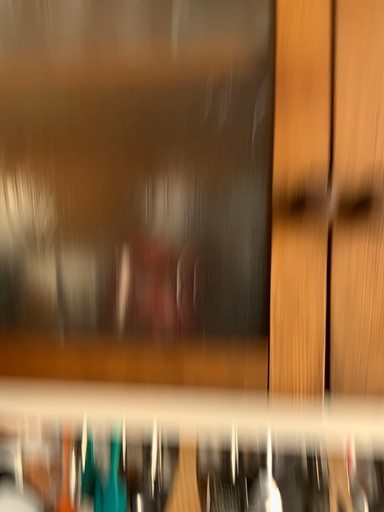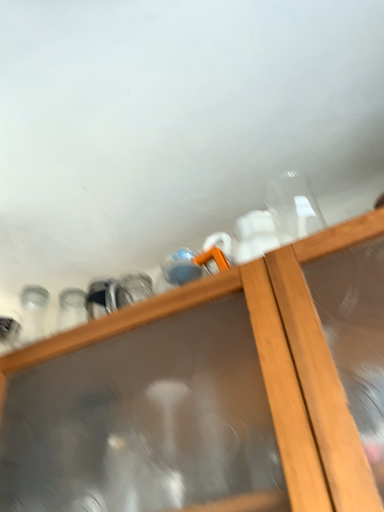
Question: Which way did the camera rotate in the video?

Choices:
 (A) rotated downward
 (B) rotated upward

Answer: (B)